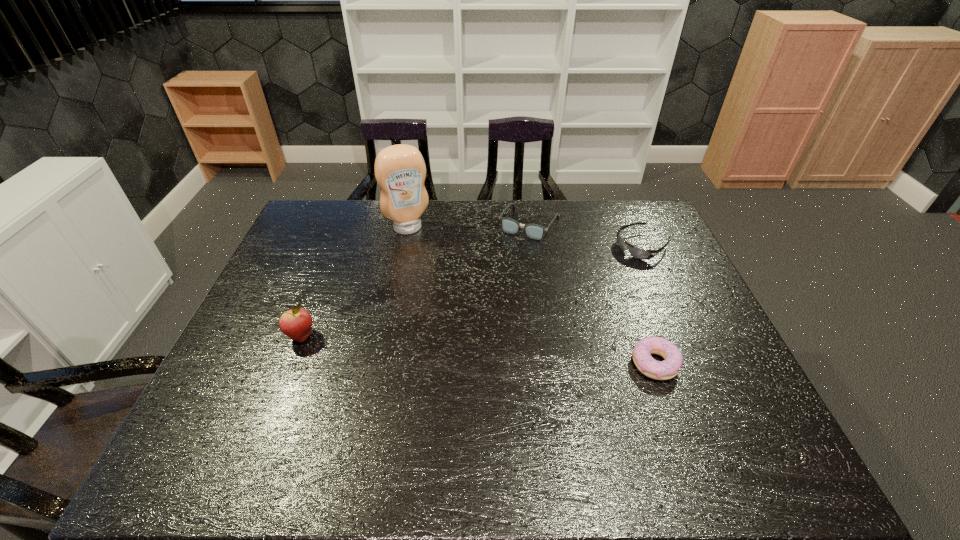
The width and height of the screenshot is (960, 540). Find the location of `free space located 0.300m on the face of the third object from left to right`. free space located 0.300m on the face of the third object from left to right is located at coordinates (484, 299).

Identify the location of free space located 0.380m on the face of the third object from left to right. This screenshot has width=960, height=540. (473, 318).

I want to click on vacant space situated on the face of the third object from left to right, so click(x=499, y=274).

The height and width of the screenshot is (540, 960). Find the location of `blank space located on the label of the tallest object`. blank space located on the label of the tallest object is located at coordinates (429, 267).

Where is `vacant region located 0.250m on the label of the tallest object`? The image size is (960, 540). vacant region located 0.250m on the label of the tallest object is located at coordinates (436, 284).

The image size is (960, 540). I want to click on vacant space located on the label of the tallest object, so click(x=419, y=245).

This screenshot has width=960, height=540. Identify the location of free region located 0.160m on the lenses of the sunglasses. (594, 278).

Image resolution: width=960 pixels, height=540 pixels. In order to click on vacant point located on the lenses of the sunglasses in this screenshot , I will do `click(539, 315)`.

This screenshot has width=960, height=540. Find the location of `vacant space located 0.160m on the lenses of the sunglasses`. vacant space located 0.160m on the lenses of the sunglasses is located at coordinates (594, 278).

Identify the location of spectacles that is at the far edge. (533, 231).